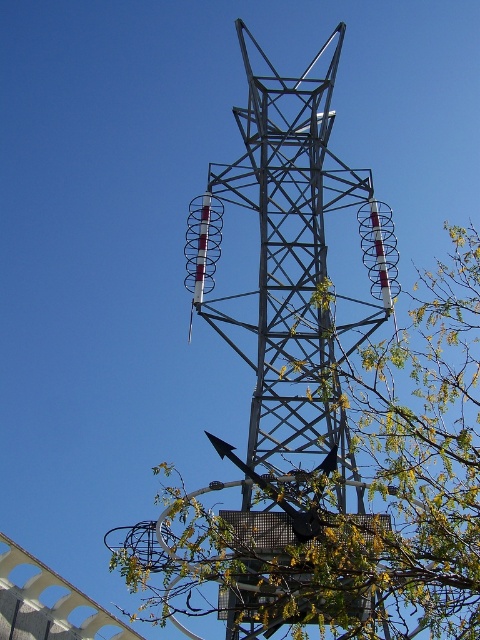
You are a bird flying near the green leafy tree at center and the metallic structure at center. Which object is closer to the ground?

The green leafy tree at center is closer to the ground since it is positioned below the metallic structure at center.

You are a bird flying towards the green leafy tree at center and the metallic structure at center. Which object will you encounter first?

The green leafy tree at center is in front of the metallic structure at center, so you will encounter the green leafy tree at center first.

You are a bird looking for a place to perch. You see a green leafy tree at center and a metallic structure at center. Which one is more to the left?

The metallic structure at center is more to the left because the green leafy tree at center is positioned on the right side of it.